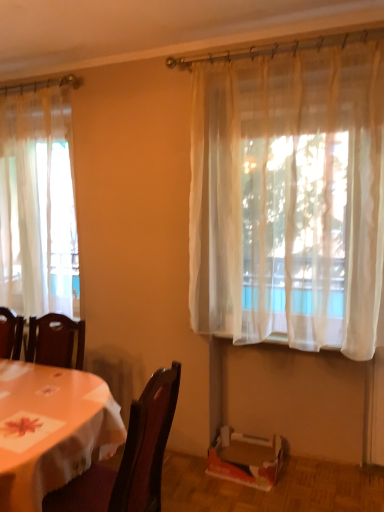
What do you see at coordinates (38, 205) in the screenshot? I see `sheer white curtain at left, the first curtain from the left` at bounding box center [38, 205].

How much space does sheer white curtain at left, positioned as the 2th curtain in right-to-left order, occupy horizontally?

It is 7.97 inches.

The height and width of the screenshot is (512, 384). Describe the element at coordinates (246, 458) in the screenshot. I see `cardboard box at lower right` at that location.

Find the location of a particular element. The height and width of the screenshot is (512, 384). sheer white curtain at upper right, placed as the second curtain when sorted from back to front is located at coordinates (289, 198).

From a real-world perspective, does wooden table at lower left sit lower than sheer white curtain at left, positioned as the 2th curtain in right-to-left order?

Indeed, from a real-world perspective, wooden table at lower left is positioned beneath sheer white curtain at left, positioned as the 2th curtain in right-to-left order.

Is wooden table at lower left facing away from sheer white curtain at left, positioned as the 2th curtain in right-to-left order?

No, wooden table at lower left is not facing the opposite direction of sheer white curtain at left, positioned as the 2th curtain in right-to-left order.

Is the position of wooden table at lower left less distant than that of sheer white curtain at left, marked as the first curtain in a back-to-front arrangement?

Yes, wooden table at lower left is closer to the viewer.

Is sheer white curtain at left, positioned as the 2th curtain in right-to-left order, touching wooden table at lower left?

No, sheer white curtain at left, positioned as the 2th curtain in right-to-left order, is not touching wooden table at lower left.

Does sheer white curtain at left, positioned as the 2th curtain in right-to-left order, have a lesser height compared to wooden table at lower left?

Incorrect, the height of sheer white curtain at left, positioned as the 2th curtain in right-to-left order, does not fall short of that of wooden table at lower left.

Is sheer white curtain at left, which appears as the 2th curtain when viewed from the front, at the right side of wooden table at lower left?

Incorrect, sheer white curtain at left, which appears as the 2th curtain when viewed from the front, is not on the right side of wooden table at lower left.

Is dark wood chair at lower left far from sheer white curtain at left, positioned as the 2th curtain in right-to-left order?

That's right, there is a large distance between dark wood chair at lower left and sheer white curtain at left, positioned as the 2th curtain in right-to-left order.

Which object is more forward, dark wood chair at lower left or sheer white curtain at left, the first curtain from the left?

dark wood chair at lower left is in front.

Is dark wood chair at lower left not inside sheer white curtain at left, marked as the first curtain in a back-to-front arrangement?

Yes.

Looking at this image, which object is positioned more to the left, sheer white curtain at upper right, the 1th curtain positioned from the front, or dark wood chair at lower left?

From the viewer's perspective, dark wood chair at lower left appears more on the left side.

Does sheer white curtain at upper right, the 1th curtain positioned from the front, have a lesser height compared to dark wood chair at lower left?

No.

What's the angular difference between sheer white curtain at upper right, which is the 2th curtain from left to right, and dark wood chair at lower left's facing directions?

sheer white curtain at upper right, which is the 2th curtain from left to right, and dark wood chair at lower left are facing 90.2 degrees away from each other.

Is sheer white curtain at upper right, acting as the 1th curtain starting from the right, inside the boundaries of dark wood chair at lower left, or outside?

sheer white curtain at upper right, acting as the 1th curtain starting from the right, exists outside the volume of dark wood chair at lower left.

Consider the image. From the image's perspective, is wooden table at lower left located above dark wood chair at lower left?

Incorrect, from the image's perspective, wooden table at lower left is lower than dark wood chair at lower left.

Which point is more distant from viewer, (72, 432) or (101, 504)?

Positioned behind is point (101, 504).

Which of these two, wooden table at lower left or dark wood chair at lower left, is bigger?

Answer: With larger size is wooden table at lower left.

Which object is positioned more to the left, wooden table at lower left or dark wood chair at lower left?

Positioned to the left is wooden table at lower left.

Is sheer white curtain at upper right, which is the 2th curtain from left to right, not inside sheer white curtain at left, marked as the first curtain in a back-to-front arrangement?

Absolutely, sheer white curtain at upper right, which is the 2th curtain from left to right, is external to sheer white curtain at left, marked as the first curtain in a back-to-front arrangement.

Considering the points (242, 162) and (14, 276), which point is in front, point (242, 162) or point (14, 276)?

Positioned in front is point (242, 162).

Consider the image. Does sheer white curtain at upper right, placed as the second curtain when sorted from back to front, have a greater width compared to sheer white curtain at left, which appears as the 2th curtain when viewed from the front?

No.

Is sheer white curtain at upper right, acting as the 1th curtain starting from the right, turned away from sheer white curtain at left, which appears as the 2th curtain when viewed from the front?

No, sheer white curtain at upper right, acting as the 1th curtain starting from the right, is not facing away from sheer white curtain at left, which appears as the 2th curtain when viewed from the front.

Is dark wood chair at lower left far away from sheer white curtain at upper right, placed as the second curtain when sorted from back to front?

dark wood chair at lower left is positioned a significant distance from sheer white curtain at upper right, placed as the second curtain when sorted from back to front.

Is point (89, 477) closer or farther from the camera than point (287, 63)?

Point (89, 477).

In the scene shown: Between dark wood chair at lower left and sheer white curtain at upper right, the 1th curtain positioned from the front, which one appears on the left side from the viewer's perspective?

dark wood chair at lower left.

From the image's perspective, which one is positioned lower, dark wood chair at lower left or sheer white curtain at upper right, acting as the 1th curtain starting from the right?

dark wood chair at lower left, from the image's perspective.

From a real-world perspective, which curtain is the 1st one above the wooden table at lower left? Please provide its 2D coordinates.

[(38, 205)]

Locate an element on the screen. desk below the sheer white curtain at left, marked as the first curtain in a back-to-front arrangement (from a real-world perspective) is located at coordinates click(51, 429).

Estimate the real-world distances between objects in this image. Which object is closer to sheer white curtain at left, the first curtain from the left, sheer white curtain at upper right, acting as the 1th curtain starting from the right, or dark wood chair at lower left?

sheer white curtain at upper right, acting as the 1th curtain starting from the right, is positioned closer to the anchor sheer white curtain at left, the first curtain from the left.

Looking at the image, which one is located further to sheer white curtain at upper right, acting as the 1th curtain starting from the right, sheer white curtain at left, the first curtain from the left, or cardboard box at lower right?

sheer white curtain at left, the first curtain from the left.

From the image, which object appears to be farther from dark wood chair at lower left, cardboard box at lower right or sheer white curtain at upper right, placed as the second curtain when sorted from back to front?

sheer white curtain at upper right, placed as the second curtain when sorted from back to front, is further to dark wood chair at lower left.

Which object lies nearer to the anchor point dark wood chair at lower left, sheer white curtain at left, marked as the first curtain in a back-to-front arrangement, or cardboard box at lower right?

cardboard box at lower right is closer to dark wood chair at lower left.

Looking at the image, which one is located closer to wooden table at lower left, dark wood chair at lower left or sheer white curtain at left, which appears as the 2th curtain when viewed from the front?

dark wood chair at lower left.

From the image, which object appears to be farther from wooden table at lower left, sheer white curtain at left, positioned as the 2th curtain in right-to-left order, or dark wood chair at lower left?

sheer white curtain at left, positioned as the 2th curtain in right-to-left order, is positioned further to the anchor wooden table at lower left.

From the image, which object appears to be farther from wooden table at lower left, sheer white curtain at left, the first curtain from the left, or sheer white curtain at upper right, acting as the 1th curtain starting from the right?

sheer white curtain at upper right, acting as the 1th curtain starting from the right, is positioned further to the anchor wooden table at lower left.

In the scene shown: Based on their spatial positions, is cardboard box at lower right or wooden table at lower left closer to dark wood chair at lower left?

Among the two, wooden table at lower left is located nearer to dark wood chair at lower left.

Identify the location of chair between wooden table at lower left and sheer white curtain at left, the first curtain from the left, in the front-back direction. (129, 458).

At what (x,y) coordinates should I click in order to perform the action: click on desk between sheer white curtain at left, which appears as the 2th curtain when viewed from the front, and sheer white curtain at upper right, which is the 2th curtain from left to right, in the horizontal direction. Please return your answer as a coordinate pair (x, y). The image size is (384, 512). Looking at the image, I should click on (51, 429).

Find the location of a particular element. Image resolution: width=384 pixels, height=512 pixels. desk between sheer white curtain at left, which appears as the 2th curtain when viewed from the front, and cardboard box at lower right from top to bottom is located at coordinates (51, 429).

The width and height of the screenshot is (384, 512). Identify the location of chair between sheer white curtain at left, the first curtain from the left, and sheer white curtain at upper right, the 1th curtain positioned from the front. (129, 458).